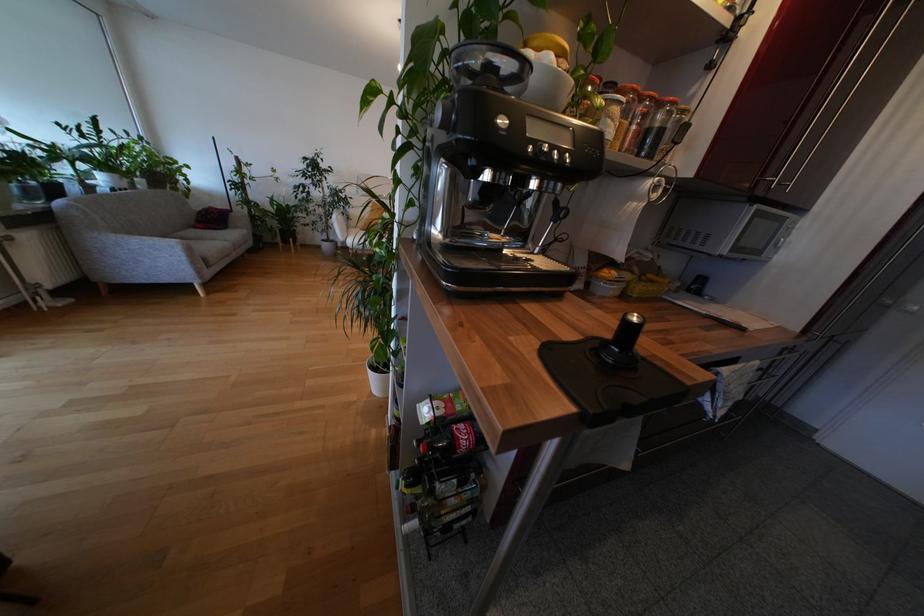
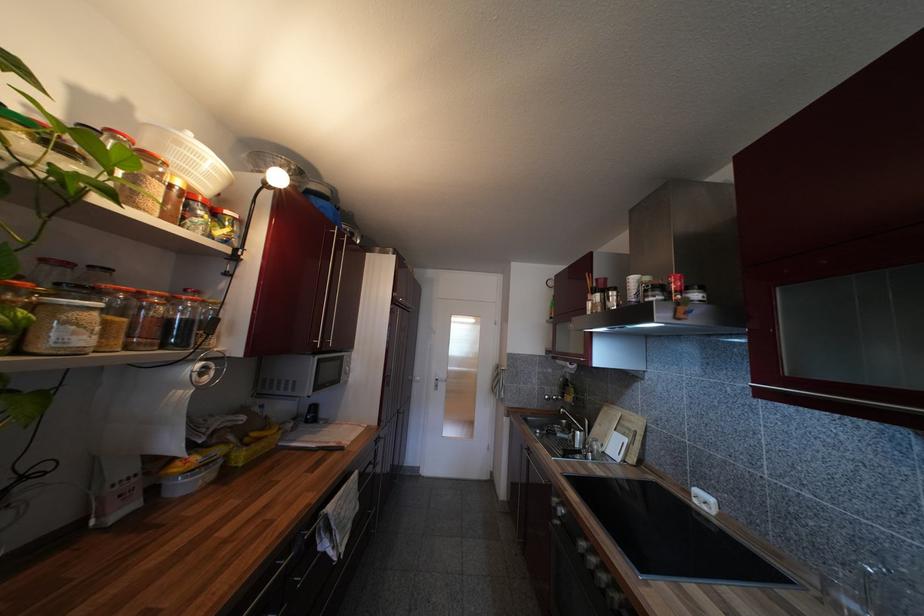
Find the pixel in the second image that matches point 621,280 in the first image.

(204, 464)